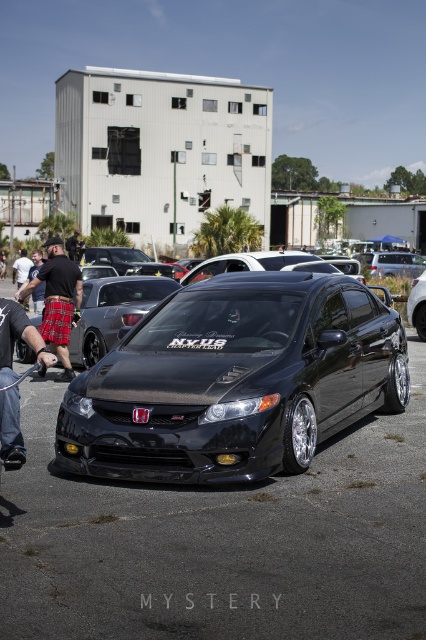
Can you confirm if black glossy car at center is taller than black leather pants at lower left?

Incorrect, black glossy car at center's height is not larger of black leather pants at lower left's.

Which of these two, black glossy car at center or black leather pants at lower left, stands taller?

With more height is black leather pants at lower left.

Is point (328, 522) closer to camera compared to point (26, 321)?

Yes, point (328, 522) is in front of point (26, 321).

Identify the location of black glossy car at center. The image size is (426, 640). click(x=221, y=541).

Which is more to the right, black matte sports car at center or black plaid shorts at lower left?

Positioned to the right is black matte sports car at center.

Is black matte sports car at center to the left of black plaid shorts at lower left from the viewer's perspective?

Incorrect, black matte sports car at center is not on the left side of black plaid shorts at lower left.

Is point (106, 300) behind point (43, 284)?

No.

At what (x,y) coordinates should I click in order to perform the action: click on black matte sports car at center. Please return your answer as a coordinate pair (x, y). Image resolution: width=426 pixels, height=640 pixels. Looking at the image, I should click on (112, 310).

Who is positioned more to the right, black plaid shorts at left or black fabric shorts at lower left?

From the viewer's perspective, black plaid shorts at left appears more on the right side.

From the picture: Can you confirm if black plaid shorts at left is wider than black fabric shorts at lower left?

In fact, black plaid shorts at left might be narrower than black fabric shorts at lower left.

Describe the element at coordinates (57, 301) in the screenshot. I see `black plaid shorts at left` at that location.

You are a GUI agent. You are given a task and a screenshot of the screen. Output one action in this format:
    pyautogui.click(x=<x>, y=<y>)
    Task: Click on the black plaid shorts at left
    The width and height of the screenshot is (426, 640).
    Given the screenshot: What is the action you would take?
    pyautogui.click(x=57, y=301)